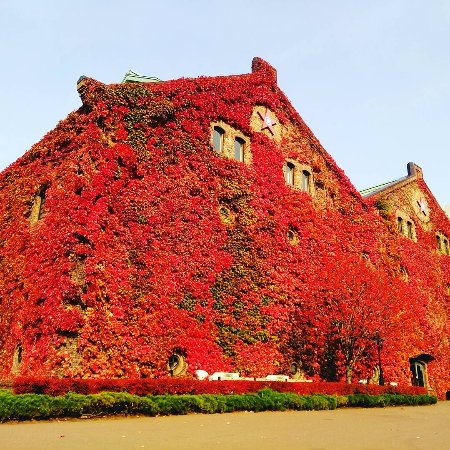
Locate an element on the screen. The width and height of the screenshot is (450, 450). entryway is located at coordinates 417,376.